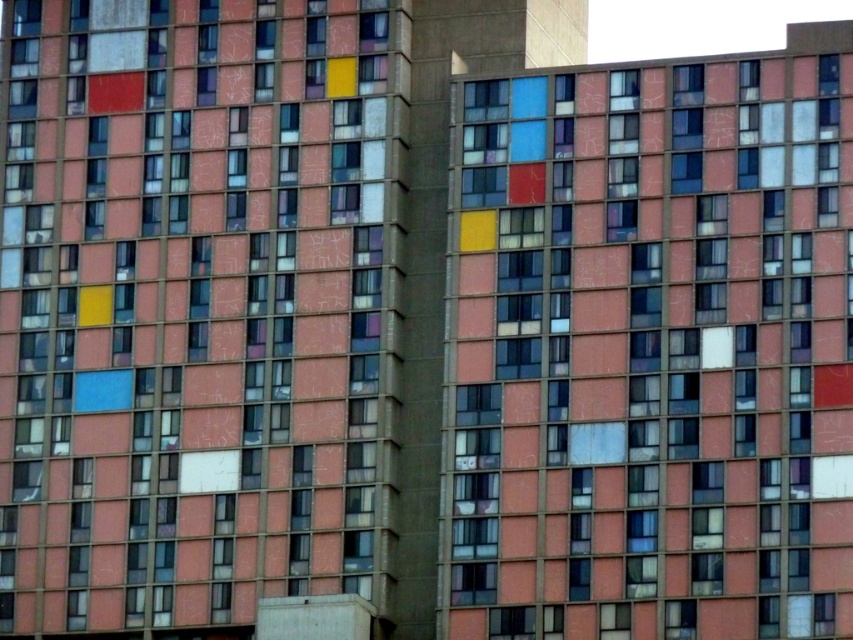
Who is higher up, matte pink window at center or matte glass window at center?

Positioned higher is matte pink window at center.

Is matte pink window at center positioned behind matte glass window at center?

Yes, matte pink window at center is further from the viewer.

This screenshot has width=853, height=640. What are the coordinates of `matte pink window at center` in the screenshot? It's located at (196, 307).